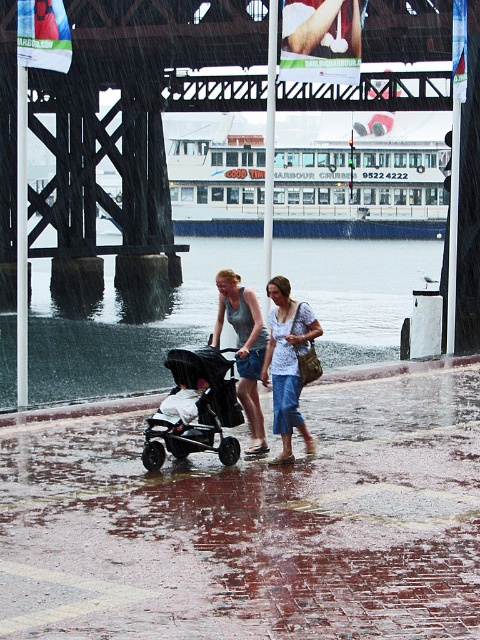
You are standing on the wet brick pavement at center and want to walk to the dry area. Which direction should you move relative to the denim pants at center?

The wet brick pavement at center is positioned on the right side of denim pants at center. To reach a dry area, you should move to the left side away from the wet brick pavement at center.

You are a delivery person trying to navigate through the wet brick pavement at center and the denim pants at center. Which path has more space to move around?

The denim pants at center has a greater width than the wet brick pavement at center, so there is more space to move around the denim pants at center.

You are a photographer trying to capture a closeup shot of the denim pants at center and the matte black stroller at center. Given their sizes, which one would require you to move closer to get a detailed shot?

The denim pants at center has a smaller size compared to the matte black stroller at center, so you would need to move closer to the denim pants at center to capture its details.